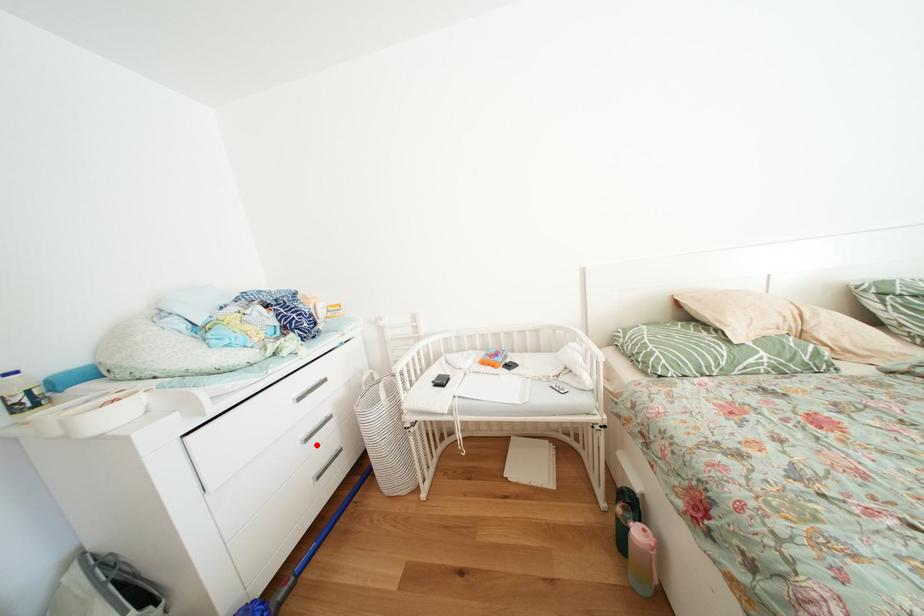
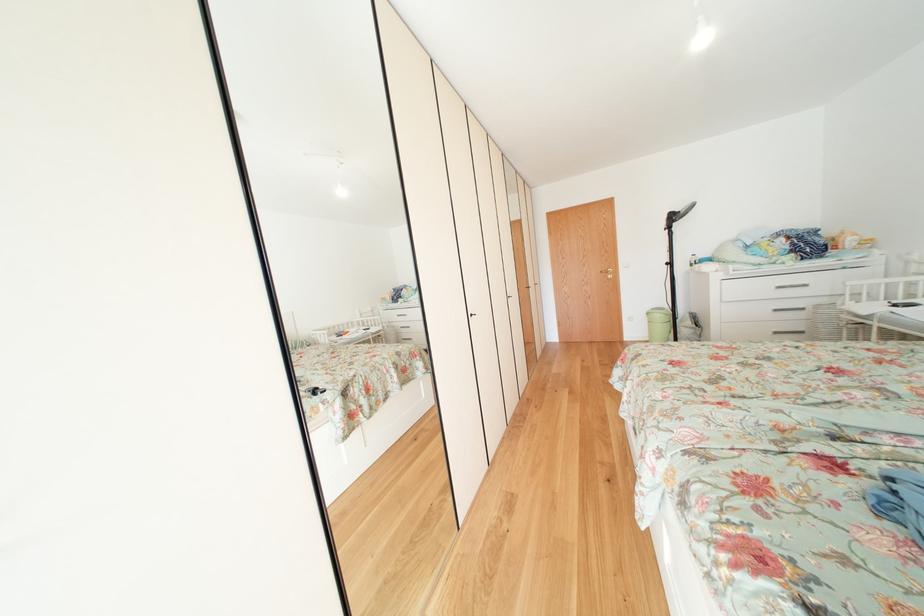
Locate, in the second image, the point that corresponds to the highlighted location in the first image.

(784, 315)